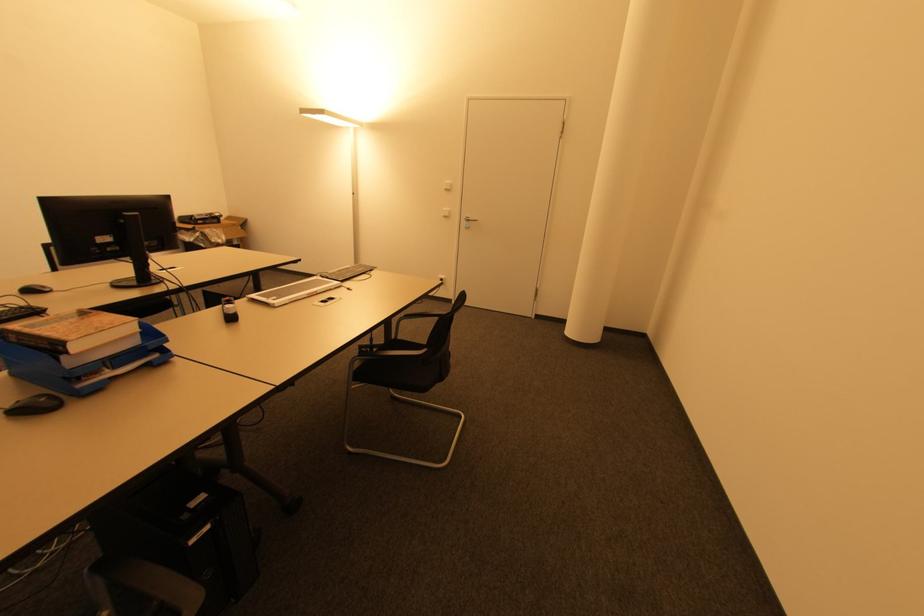
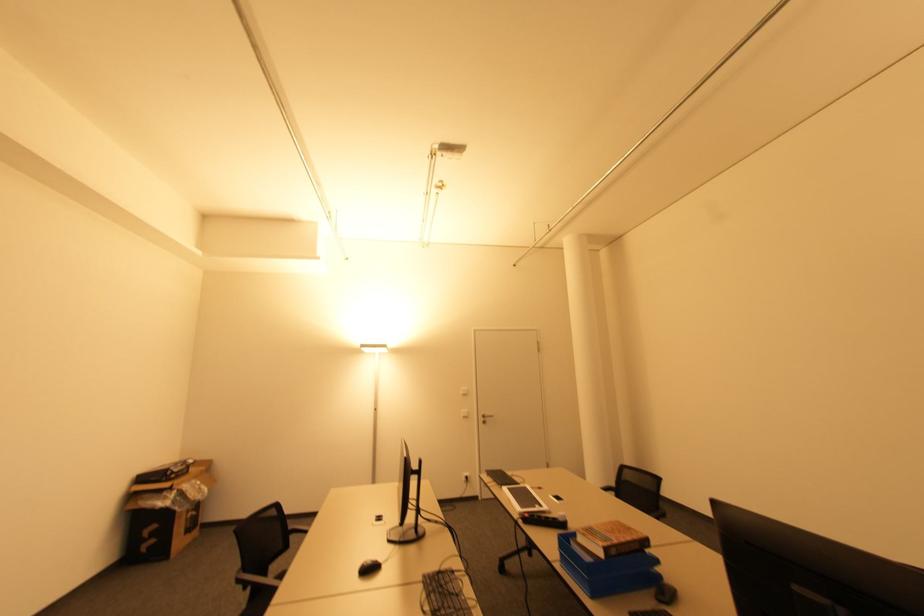
Find the pixel in the second image that matches [446,217] in the first image.

(467, 416)